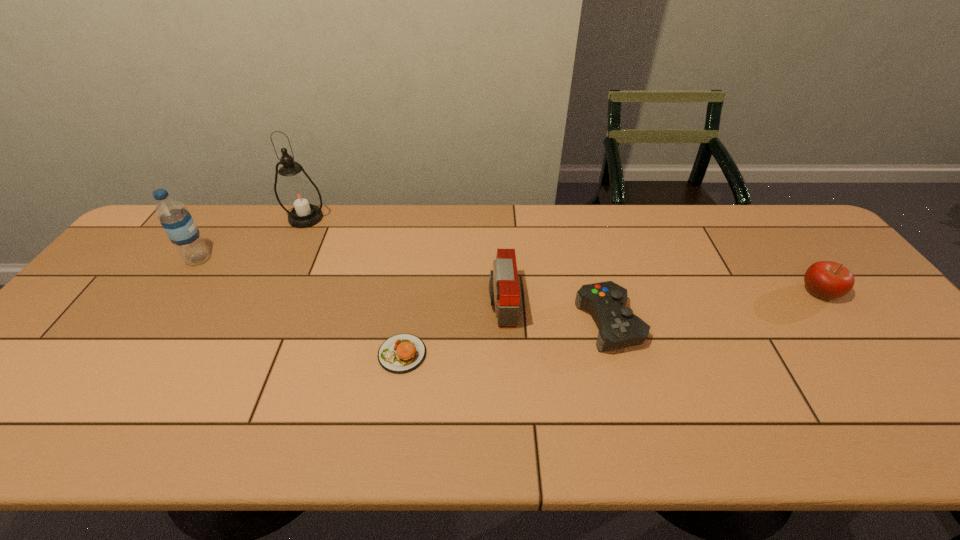
Find the location of a particular element. oil lamp positioned at the far edge is located at coordinates (298, 195).

Find the location of a particular element. The width and height of the screenshot is (960, 540). water bottle that is at the far edge is located at coordinates (177, 222).

At what (x,y) coordinates should I click in order to perform the action: click on object that is at the right edge. Please return your answer as a coordinate pair (x, y). Image resolution: width=960 pixels, height=540 pixels. Looking at the image, I should click on (828, 280).

Identify the location of vacant space at the far edge of the desktop. The width and height of the screenshot is (960, 540). (607, 224).

In the image, there is a desktop. Identify the location of vacant space at the near edge. (708, 436).

Find the location of `vacant space at the right edge of the desktop`. vacant space at the right edge of the desktop is located at coordinates (896, 406).

The height and width of the screenshot is (540, 960). In order to click on vacant space at the far left corner of the desktop in this screenshot , I will do `click(160, 225)`.

Locate an element on the screen. The width and height of the screenshot is (960, 540). free spot at the near left corner of the desktop is located at coordinates (12, 415).

Where is `free space at the far right corner`? free space at the far right corner is located at coordinates (800, 231).

This screenshot has height=540, width=960. I want to click on free space at the near right corner, so click(x=937, y=434).